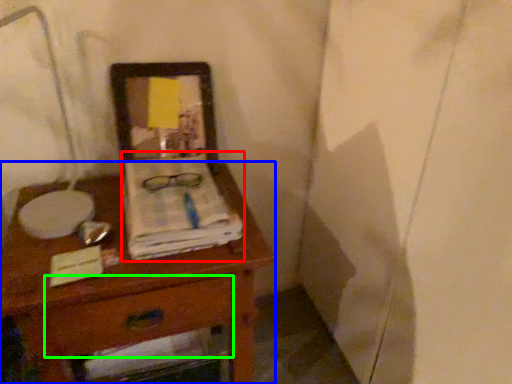
Question: Which object is positioned closest to magazine (highlighted by a red box)? Select from desk (highlighted by a blue box) and drawer (highlighted by a green box).

Choices:
 (A) desk
 (B) drawer

Answer: (A)